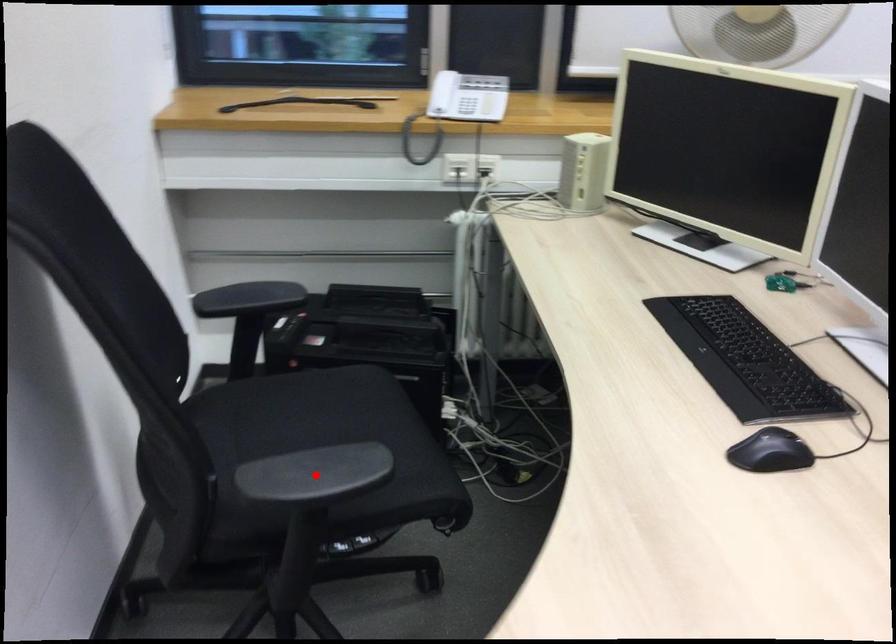
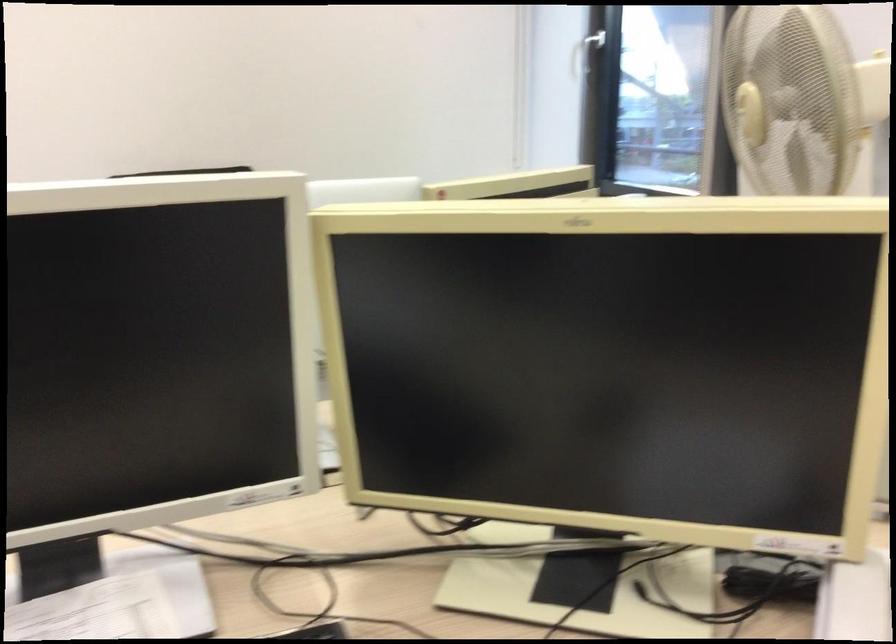
Question: I am providing you with two images of the same scene from different viewpoints. A red point is marked on the first image. At the location where the point appears in image 1, is it still visible in image 2?

Choices:
 (A) Yes
 (B) No

Answer: (B)